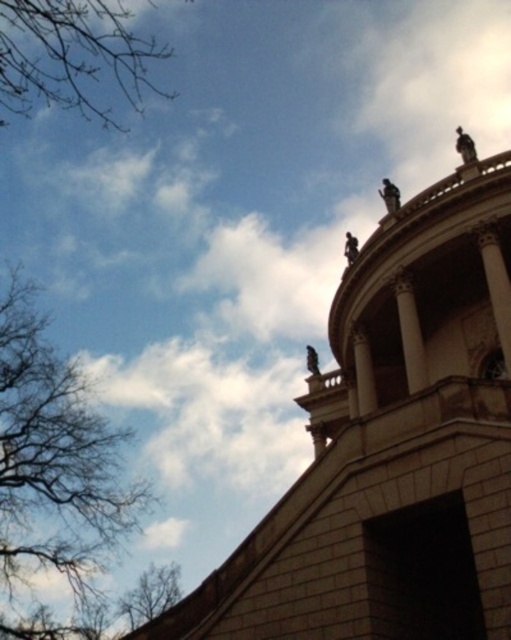
Question: Which point is farther to the camera?

Choices:
 (A) bare branches at lower left
 (B) bare branches at upper left
 (C) brown leafless tree at left

Answer: (A)

Question: Can you confirm if bare branches at upper left is positioned to the right of bare branches at lower left?

Choices:
 (A) yes
 (B) no

Answer: (B)

Question: Which is farther from the bare branches at upper left?

Choices:
 (A) bare branches at lower left
 (B) brown leafless tree at left

Answer: (A)

Question: Where is brown leafless tree at left located in relation to bare branches at upper left in the image?

Choices:
 (A) right
 (B) left

Answer: (B)

Question: Which of the following is the closest to the observer?

Choices:
 (A) bare branches at upper left
 (B) bare branches at lower left
 (C) brown leafless tree at left

Answer: (A)

Question: Considering the relative positions of brown leafless tree at left and bare branches at lower left in the image provided, where is brown leafless tree at left located with respect to bare branches at lower left?

Choices:
 (A) left
 (B) right

Answer: (A)